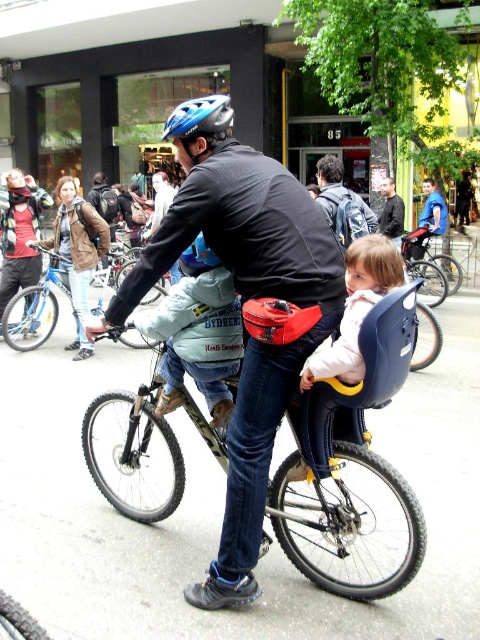
Consider the image. You are standing at the camera position and want to reach the point marked as point (320, 368). If you can walk 3 feet per second, how long will it take you to reach that point?

The point (320, 368) is 7.68 feet away from the camera. At a walking speed of 3 feet per second, it would take approximately 2.56 seconds to reach the point.